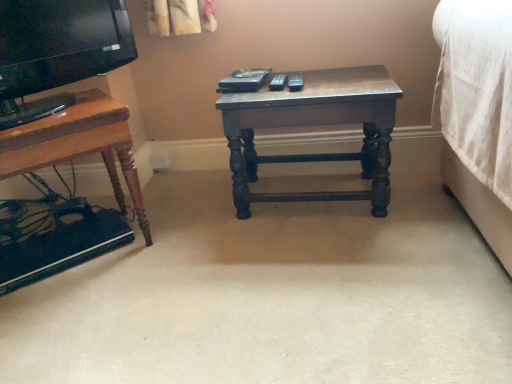
This screenshot has width=512, height=384. Identify the location of wooden table at left, placed as the second table when sorted from right to left. (64, 161).

This screenshot has width=512, height=384. Describe the element at coordinates (64, 161) in the screenshot. I see `wooden table at left, placed as the second table when sorted from right to left` at that location.

Where is `dark wood table at center, the 2th table when ordered from left to right`? dark wood table at center, the 2th table when ordered from left to right is located at coordinates (312, 125).

Describe the element at coordinates (312, 125) in the screenshot. Image resolution: width=512 pixels, height=384 pixels. I see `dark wood table at center, the 2th table when ordered from left to right` at that location.

Identify the location of wooden table at left, the first table from the left. (64, 161).

Does dark wood table at center, the 2th table when ordered from left to right, appear on the left side of wooden table at left, the first table from the left?

Incorrect, dark wood table at center, the 2th table when ordered from left to right, is not on the left side of wooden table at left, the first table from the left.

In the image, is dark wood table at center, marked as the first table in a right-to-left arrangement, positioned in front of or behind wooden table at left, the first table from the left?

In the image, dark wood table at center, marked as the first table in a right-to-left arrangement, appears behind wooden table at left, the first table from the left.

Which point is more forward, (230, 109) or (118, 155)?

The point (118, 155) is closer to the camera.

From the image's perspective, is dark wood table at center, the 2th table when ordered from left to right, positioned above or below wooden table at left, placed as the second table when sorted from right to left?

Clearly, from the image's perspective, dark wood table at center, the 2th table when ordered from left to right, is above wooden table at left, placed as the second table when sorted from right to left.

From a real-world perspective, is dark wood table at center, marked as the first table in a right-to-left arrangement, above or below wooden table at left, the first table from the left?

dark wood table at center, marked as the first table in a right-to-left arrangement, is below wooden table at left, the first table from the left.

Which of these two, dark wood table at center, marked as the first table in a right-to-left arrangement, or wooden table at left, placed as the second table when sorted from right to left, is wider?

Wider between the two is wooden table at left, placed as the second table when sorted from right to left.

From their relative heights in the image, would you say dark wood table at center, the 2th table when ordered from left to right, is taller or shorter than wooden table at left, the first table from the left?

In the image, dark wood table at center, the 2th table when ordered from left to right, appears to be shorter than wooden table at left, the first table from the left.

Does dark wood table at center, marked as the first table in a right-to-left arrangement, have a smaller size compared to wooden table at left, the first table from the left?

Indeed, dark wood table at center, marked as the first table in a right-to-left arrangement, has a smaller size compared to wooden table at left, the first table from the left.

In the scene shown: Can we say dark wood table at center, marked as the first table in a right-to-left arrangement, lies outside wooden table at left, placed as the second table when sorted from right to left?

Indeed, dark wood table at center, marked as the first table in a right-to-left arrangement, is completely outside wooden table at left, placed as the second table when sorted from right to left.

Is dark wood table at center, the 2th table when ordered from left to right, beside wooden table at left, placed as the second table when sorted from right to left?

dark wood table at center, the 2th table when ordered from left to right, is not next to wooden table at left, placed as the second table when sorted from right to left, and they're not touching.

Does dark wood table at center, marked as the first table in a right-to-left arrangement, turn towards wooden table at left, placed as the second table when sorted from right to left?

No, dark wood table at center, marked as the first table in a right-to-left arrangement, is not aimed at wooden table at left, placed as the second table when sorted from right to left.

How many degrees apart are the facing directions of dark wood table at center, the 2th table when ordered from left to right, and wooden table at left, the first table from the left?

They differ by 40.3 degrees in their facing directions.

Image resolution: width=512 pixels, height=384 pixels. Identify the location of table above the dark wood table at center, the 2th table when ordered from left to right (from a real-world perspective). (64, 161).

Is wooden table at left, placed as the second table when sorted from right to left, at the left side of dark wood table at center, marked as the first table in a right-to-left arrangement?

Correct, you'll find wooden table at left, placed as the second table when sorted from right to left, to the left of dark wood table at center, marked as the first table in a right-to-left arrangement.

Which is behind, wooden table at left, placed as the second table when sorted from right to left, or dark wood table at center, marked as the first table in a right-to-left arrangement?

Positioned behind is dark wood table at center, marked as the first table in a right-to-left arrangement.

Does point (44, 140) appear closer or farther from the camera than point (386, 189)?

Point (44, 140).

Looking at this image, from the image's perspective, which one is positioned lower, wooden table at left, placed as the second table when sorted from right to left, or dark wood table at center, the 2th table when ordered from left to right?

wooden table at left, placed as the second table when sorted from right to left, appears lower in the image.

From a real-world perspective, is wooden table at left, placed as the second table when sorted from right to left, beneath dark wood table at center, the 2th table when ordered from left to right?

No, from a real-world perspective, wooden table at left, placed as the second table when sorted from right to left, is not below dark wood table at center, the 2th table when ordered from left to right.

Considering the sizes of objects wooden table at left, the first table from the left, and dark wood table at center, marked as the first table in a right-to-left arrangement, in the image provided, who is thinner, wooden table at left, the first table from the left, or dark wood table at center, marked as the first table in a right-to-left arrangement,?

Thinner between the two is dark wood table at center, marked as the first table in a right-to-left arrangement.

Does wooden table at left, placed as the second table when sorted from right to left, have a greater height compared to dark wood table at center, the 2th table when ordered from left to right?

Indeed, wooden table at left, placed as the second table when sorted from right to left, has a greater height compared to dark wood table at center, the 2th table when ordered from left to right.

Who is bigger, wooden table at left, the first table from the left, or dark wood table at center, marked as the first table in a right-to-left arrangement?

wooden table at left, the first table from the left, is bigger.

Could dark wood table at center, marked as the first table in a right-to-left arrangement, be considered to be inside wooden table at left, placed as the second table when sorted from right to left?

No, dark wood table at center, marked as the first table in a right-to-left arrangement, is located outside of wooden table at left, placed as the second table when sorted from right to left.

Is wooden table at left, placed as the second table when sorted from right to left, with dark wood table at center, the 2th table when ordered from left to right?

No, wooden table at left, placed as the second table when sorted from right to left, is not in contact with dark wood table at center, the 2th table when ordered from left to right.

Is wooden table at left, placed as the second table when sorted from right to left, turned away from dark wood table at center, the 2th table when ordered from left to right?

No, wooden table at left, placed as the second table when sorted from right to left, is not facing away from dark wood table at center, the 2th table when ordered from left to right.

How different are the orientations of wooden table at left, placed as the second table when sorted from right to left, and dark wood table at center, marked as the first table in a right-to-left arrangement, in degrees?

40.3 degrees separate the facing orientations of wooden table at left, placed as the second table when sorted from right to left, and dark wood table at center, marked as the first table in a right-to-left arrangement.

How much distance is there between wooden table at left, the first table from the left, and dark wood table at center, marked as the first table in a right-to-left arrangement?

They are 21.15 inches apart.

Find the location of `table that is above the dark wood table at center, marked as the first table in a right-to-left arrangement (from a real-world perspective)`. table that is above the dark wood table at center, marked as the first table in a right-to-left arrangement (from a real-world perspective) is located at coordinates (64, 161).

At what (x,y) coordinates should I click in order to perform the action: click on table on the right of wooden table at left, the first table from the left. Please return your answer as a coordinate pair (x, y). The height and width of the screenshot is (384, 512). Looking at the image, I should click on (312, 125).

Find the location of a particular element. table below the wooden table at left, the first table from the left (from a real-world perspective) is located at coordinates (312, 125).